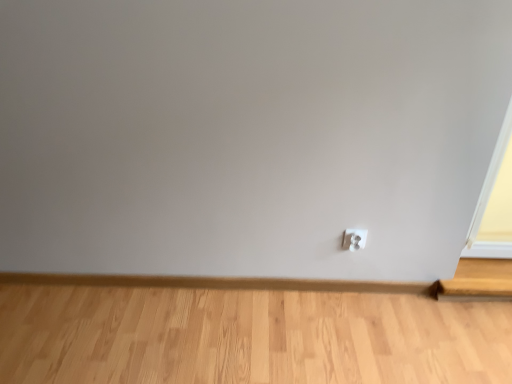
In order to click on white plastic power plug at lower right in this screenshot , I will do `click(354, 239)`.

The image size is (512, 384). What do you see at coordinates (354, 239) in the screenshot?
I see `white plastic power plug at lower right` at bounding box center [354, 239].

This screenshot has height=384, width=512. In order to click on white plastic power plug at lower right in this screenshot , I will do `click(354, 239)`.